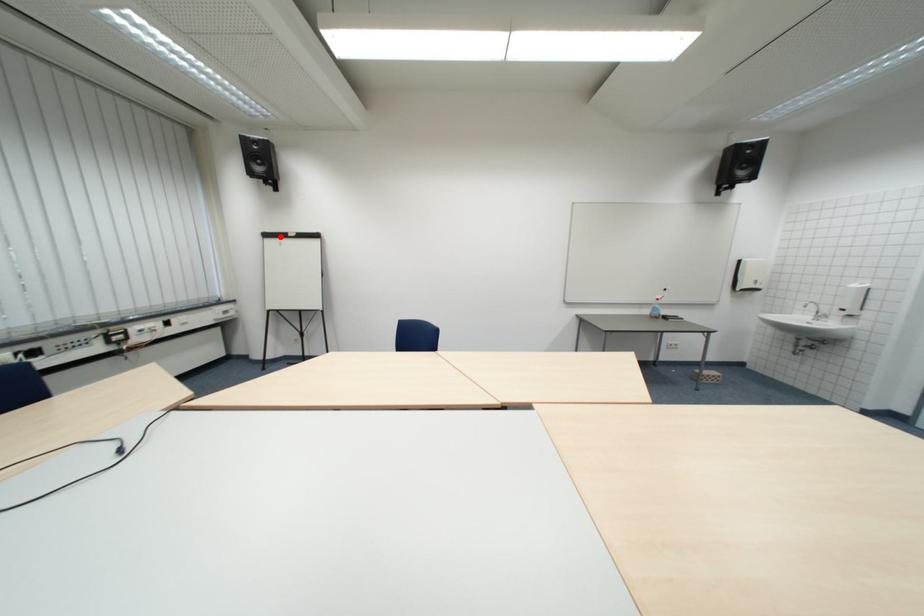
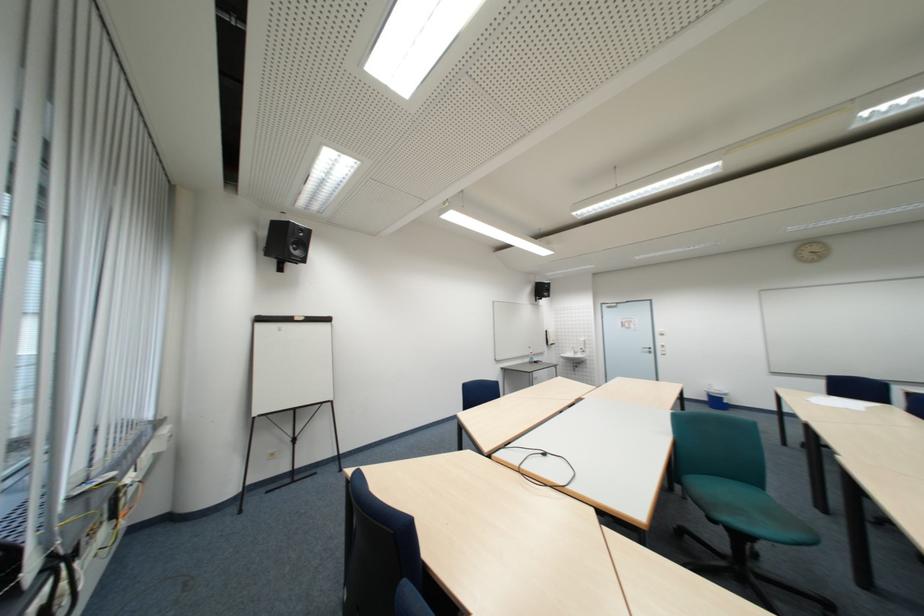
Where in the second image is the point corresponding to the highlighted location from the first image?

(273, 321)